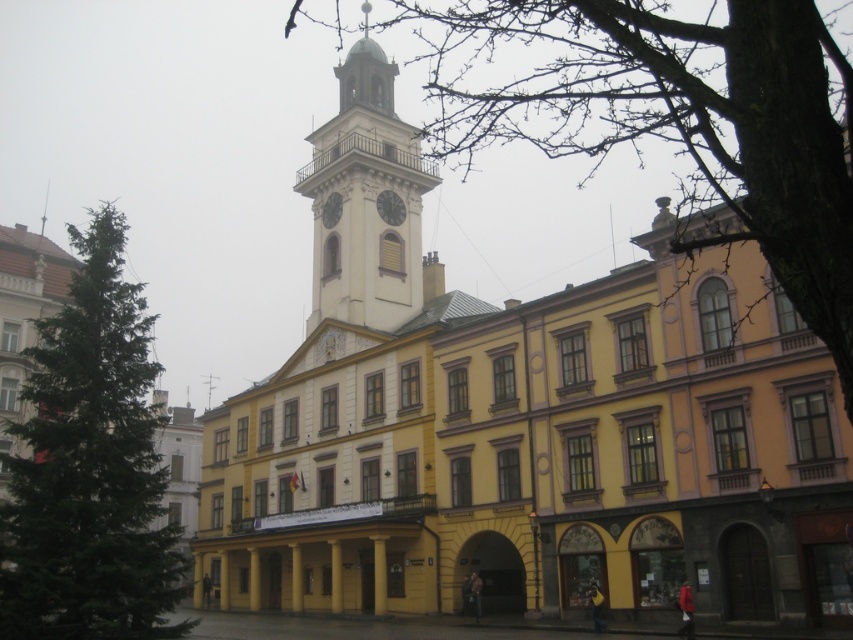
Locate an element on the screen. bare wood tree at upper center is located at coordinates (679, 120).

In the scene shown: Is bare wood tree at upper center bigger than white stone clock tower at center?

Indeed, bare wood tree at upper center has a larger size compared to white stone clock tower at center.

Image resolution: width=853 pixels, height=640 pixels. Identify the location of bare wood tree at upper center. (679, 120).

Where is `bare wood tree at upper center`? The image size is (853, 640). bare wood tree at upper center is located at coordinates (679, 120).

Is bare wood tree at upper center shorter than green textured tree at left?

No.

Does bare wood tree at upper center appear over green textured tree at left?

Correct, bare wood tree at upper center is located above green textured tree at left.

Which is behind, point (543, 92) or point (65, 404)?

Point (543, 92)

Where is `bare wood tree at upper center`? The image size is (853, 640). bare wood tree at upper center is located at coordinates (679, 120).

Between green textured tree at left and white stone clock tower at center, which one has less height?

green textured tree at left

Is green textured tree at left in front of white stone clock tower at center?

Yes, it is in front of white stone clock tower at center.

Is point (62, 632) behind point (399, 314)?

No, (62, 632) is in front of (399, 314).

This screenshot has width=853, height=640. I want to click on green textured tree at left, so click(x=90, y=467).